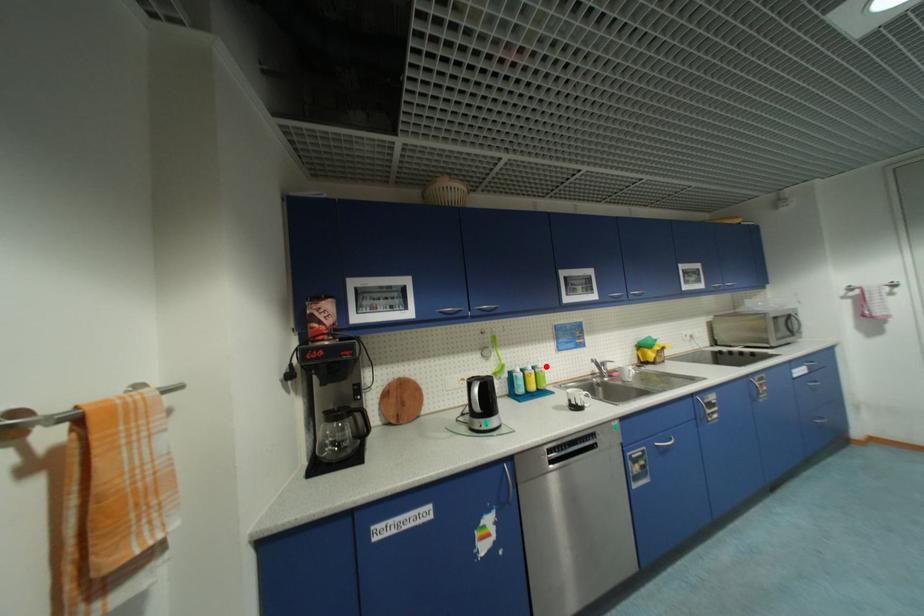
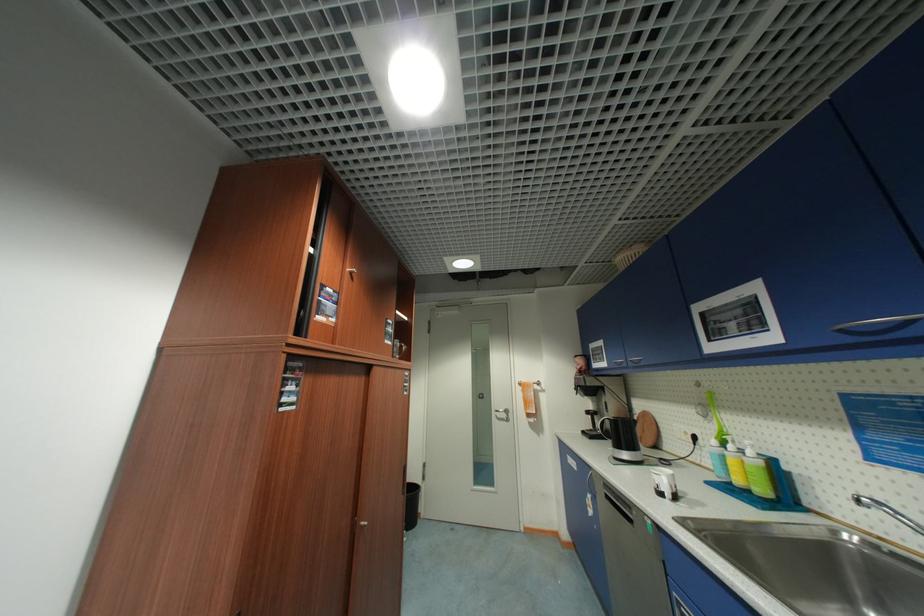
Where in the second image is the point corresponding to the highlighted location from the first image?

(756, 454)